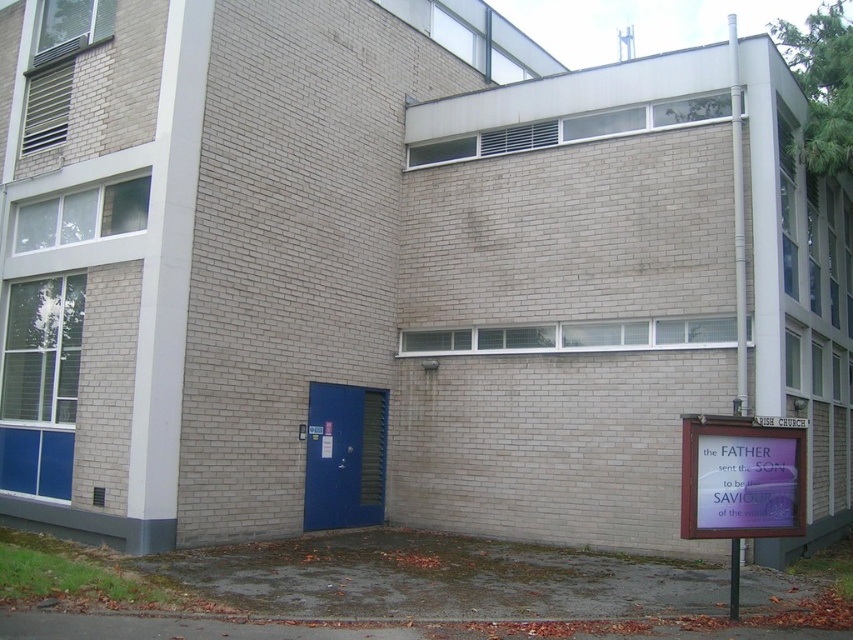
Question: Does purple glossy sign at lower right appear over blue matte door at center?

Choices:
 (A) yes
 (B) no

Answer: (A)

Question: From the image, what is the correct spatial relationship of purple glossy sign at lower right in relation to blue matte door at center?

Choices:
 (A) above
 (B) below

Answer: (A)

Question: Can you confirm if purple glossy sign at lower right is positioned below blue matte door at center?

Choices:
 (A) no
 (B) yes

Answer: (A)

Question: Which point is farther to the camera?

Choices:
 (A) blue matte door at center
 (B) purple glossy sign at lower right

Answer: (A)